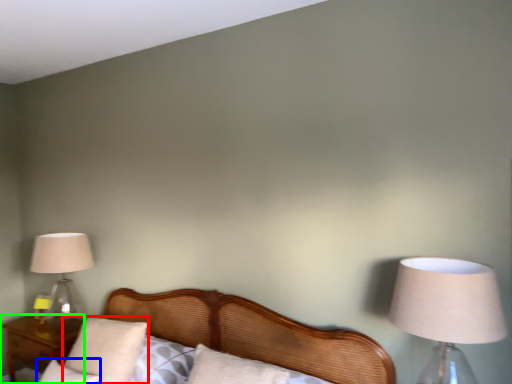
Question: Which is nearer to the pillow (highlighted by a red box)? pillow (highlighted by a blue box) or nightstand (highlighted by a green box).

Choices:
 (A) pillow
 (B) nightstand

Answer: (A)